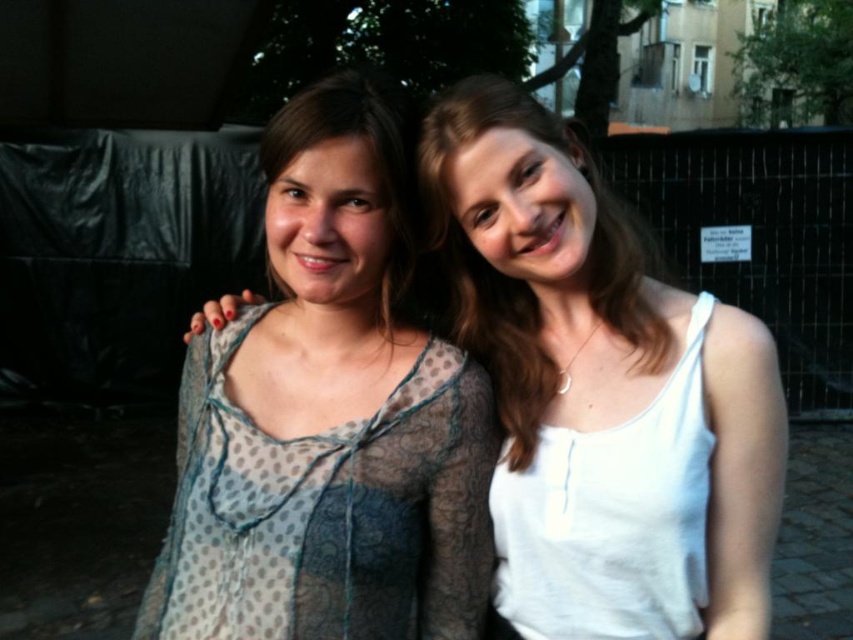
Does polka dot sheer blouse at center appear over translucent polka dot dress at center?

Indeed, polka dot sheer blouse at center is positioned over translucent polka dot dress at center.

Between point (506, 307) and point (228, 401), which one is positioned behind?

Point (506, 307)

Is point (450, 144) less distant than point (311, 480)?

Yes, point (450, 144) is in front of point (311, 480).

Identify the location of polka dot sheer blouse at center. (547, 284).

Which is below, polka dot sheer blouse at center or white cotton tank top at right?

white cotton tank top at right is below.

Where is `polka dot sheer blouse at center`? polka dot sheer blouse at center is located at coordinates (547, 284).

Is point (627, 248) in front of point (648, 609)?

No, it is not.

Image resolution: width=853 pixels, height=640 pixels. What are the coordinates of `polka dot sheer blouse at center` in the screenshot? It's located at (547, 284).

From the picture: Can you confirm if polka dot sheer blouse at center is positioned to the right of white matte tank top at center?

No, polka dot sheer blouse at center is not to the right of white matte tank top at center.

How much distance is there between polka dot sheer blouse at center and white matte tank top at center?

A distance of 2.75 inches exists between polka dot sheer blouse at center and white matte tank top at center.

Is point (479, 252) more distant than point (483, 300)?

No, it is in front of (483, 300).

Where is `polka dot sheer blouse at center`? polka dot sheer blouse at center is located at coordinates (547, 284).